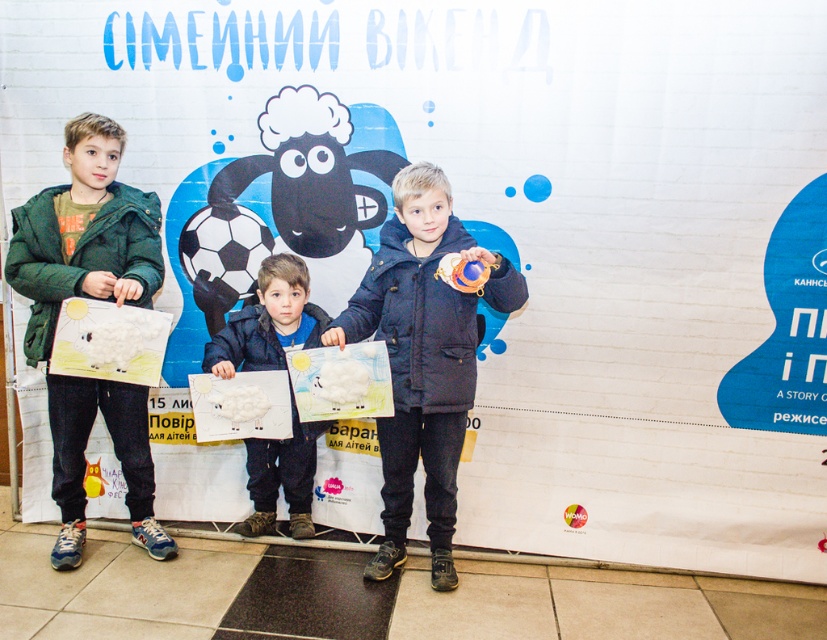
Question: Among these objects, which one is nearest to the camera?

Choices:
 (A) dark blue jacket at center
 (B) green matte jacket at left
 (C) matte white paper at center

Answer: (A)

Question: Is green matte jacket at left to the left of dark blue jacket at center from the viewer's perspective?

Choices:
 (A) yes
 (B) no

Answer: (A)

Question: From the image, what is the correct spatial relationship of dark blue jacket at center in relation to matte white paper at center?

Choices:
 (A) left
 (B) right

Answer: (B)

Question: Which of the following is the farthest from the observer?

Choices:
 (A) green matte jacket at left
 (B) matte white paper at center

Answer: (B)

Question: Which point is closer to the camera?

Choices:
 (A) green matte jacket at left
 (B) dark blue jacket at center

Answer: (B)

Question: Does green matte jacket at left come behind dark blue jacket at center?

Choices:
 (A) yes
 (B) no

Answer: (A)